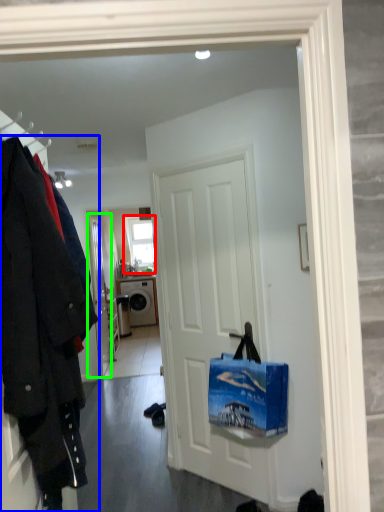
Question: Estimate the real-world distances between objects in this image. Which object is farther from window (highlighted by a red box), coat (highlighted by a blue box) or door (highlighted by a green box)?

Choices:
 (A) coat
 (B) door

Answer: (A)